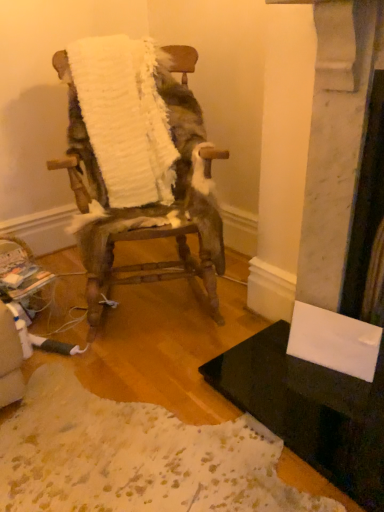
Question: Looking at the image, does black glossy table at lower right seem bigger or smaller compared to white fluffy chair at center?

Choices:
 (A) big
 (B) small

Answer: (B)

Question: From their relative heights in the image, would you say black glossy table at lower right is taller or shorter than white fluffy chair at center?

Choices:
 (A) tall
 (B) short

Answer: (B)

Question: Based on their relative distances, which object is farther from the white fluffy blanket at center?

Choices:
 (A) black glossy table at lower right
 (B) white fluffy chair at center

Answer: (A)

Question: Estimate the real-world distances between objects in this image. Which object is farther from the black glossy table at lower right?

Choices:
 (A) white fluffy chair at center
 (B) white fluffy blanket at center

Answer: (B)